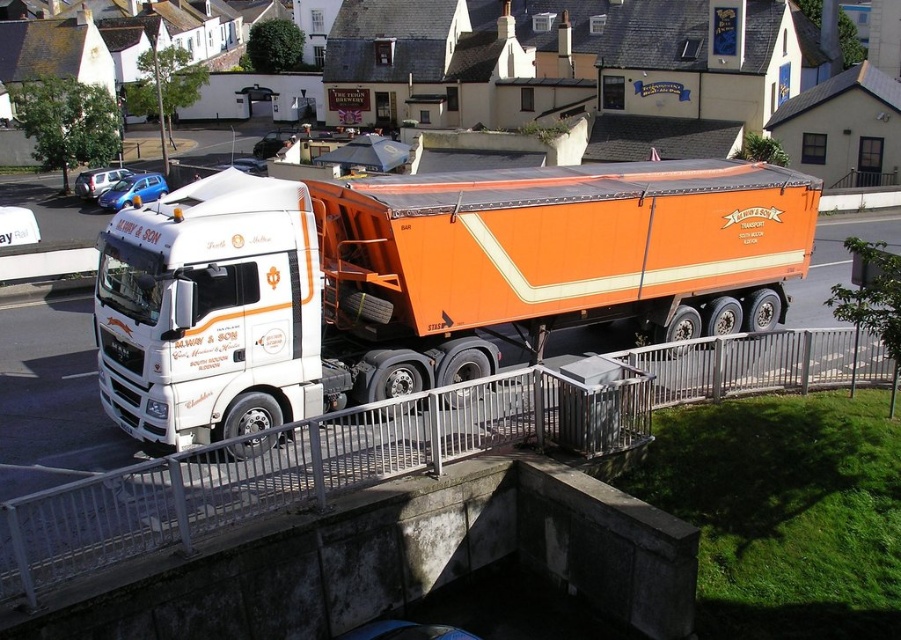
In the scene shown: You are a delivery driver who needs to park the orange matte trailer truck at center on a flat surface. The white metal rail at center is blocking the way. Is there enough space to maneuver around the rail?

The orange matte trailer truck at center is located above the white metal rail at center, so there is enough vertical space to maneuver around the rail without obstruction.

You are standing at the origin point of the coordinate system. You want to walk to the orange matte trailer truck at center. In which direction should you move?

The orange matte trailer truck at center is located at coordinate point (419, 280), so you should move northeast to reach it.